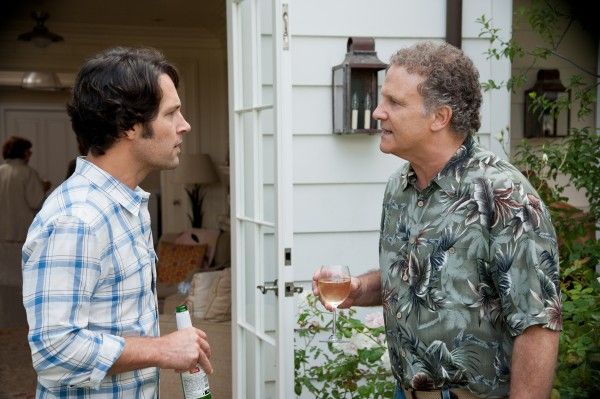
The width and height of the screenshot is (600, 399). I want to click on lantern lightbulb, so click(359, 106).